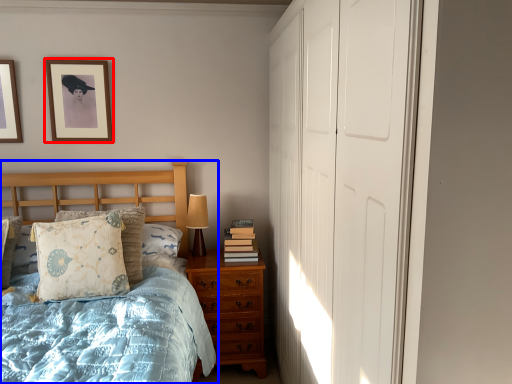
Question: Which point is further to the camera, picture frame (highlighted by a red box) or bed (highlighted by a blue box)?

Choices:
 (A) picture frame
 (B) bed

Answer: (A)